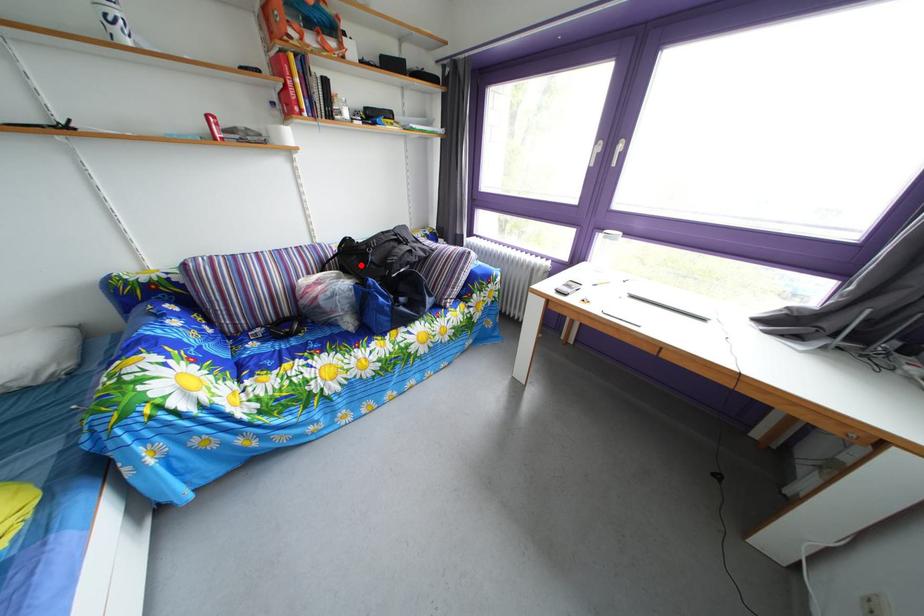
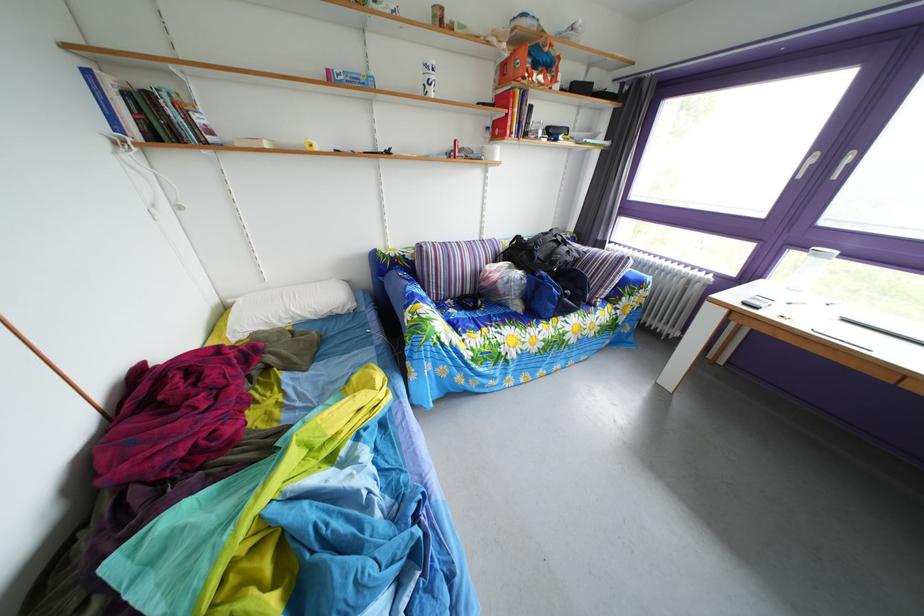
Question: I am providing you with two images of the same scene from different viewpoints. A red point is marked on the first image. Can you still see the location of the red point in image 2?

Choices:
 (A) Yes
 (B) No

Answer: (A)